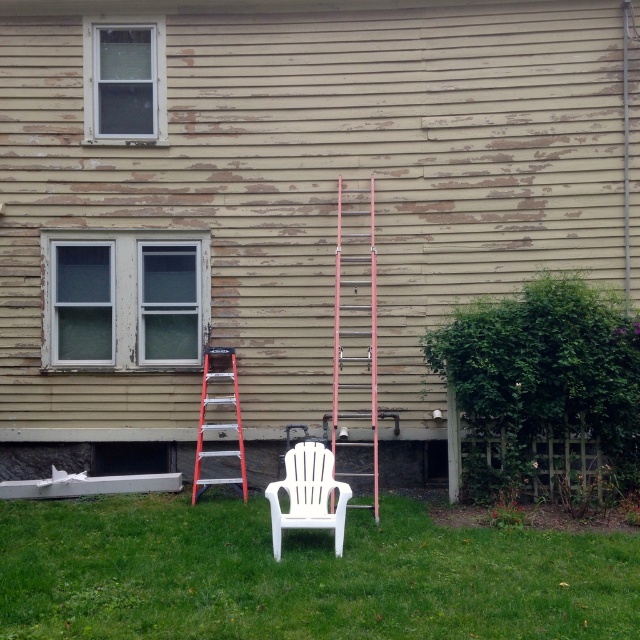
You are standing in front of the house and want to place a small decoration between the two points labeled point (376, 420) and point (225, 403). Which point should the decoration be closer to if you want it nearer to the camera?

The decoration should be placed closer to point (376, 420) because it is nearer to the camera compared to point (225, 403).

You are standing at the entrance of the house and want to place a potted plant on the green grass at center. According to the image, where exactly should you place it?

The green grass at center is located at point (x=300, y=573), so you should place the potted plant at those coordinates.